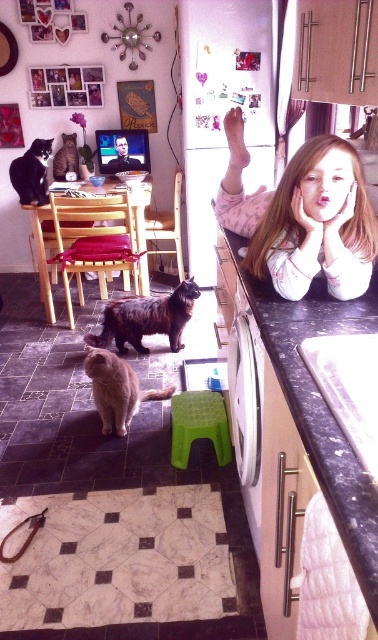
Question: Which of the following is the farthest from the observer?

Choices:
 (A) (148, 392)
 (B) (165, 308)

Answer: (B)

Question: Which point is closer to the camera taking this photo?

Choices:
 (A) (26, 163)
 (B) (210, 410)
 (C) (120, 433)

Answer: (B)

Question: Which of the following is the closest to the observer?

Choices:
 (A) (170, 417)
 (B) (154, 314)
 (C) (359, 173)

Answer: (C)

Question: Does black granite countertop at center appear on the left side of green plastic stool at lower center?

Choices:
 (A) no
 (B) yes

Answer: (A)

Question: Can you confirm if dark brown shaggy cat at center is bigger than orange fur cat at center?

Choices:
 (A) no
 (B) yes

Answer: (A)

Question: Considering the relative positions of smooth skin girl at upper right and orange fur cat at center in the image provided, where is smooth skin girl at upper right located with respect to orange fur cat at center?

Choices:
 (A) above
 (B) below

Answer: (A)